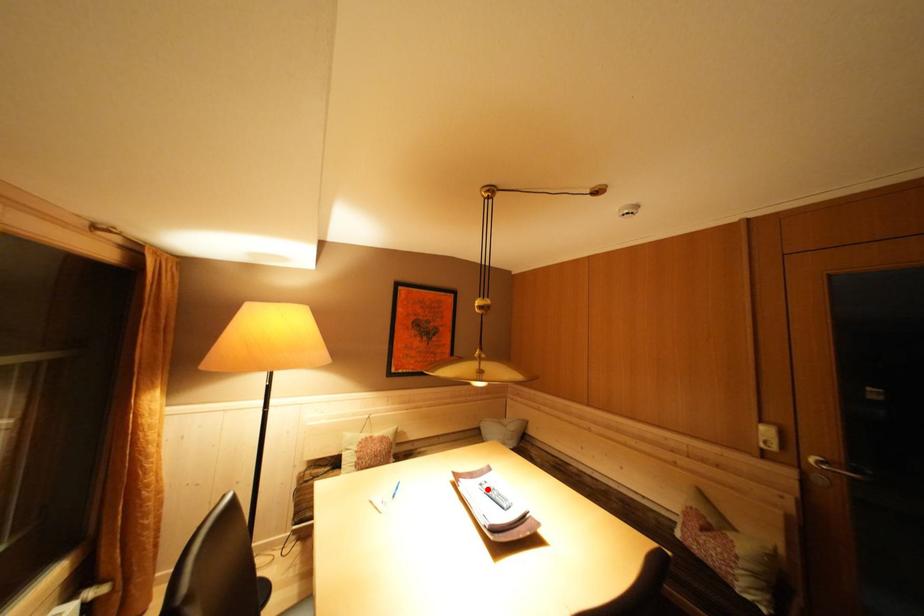
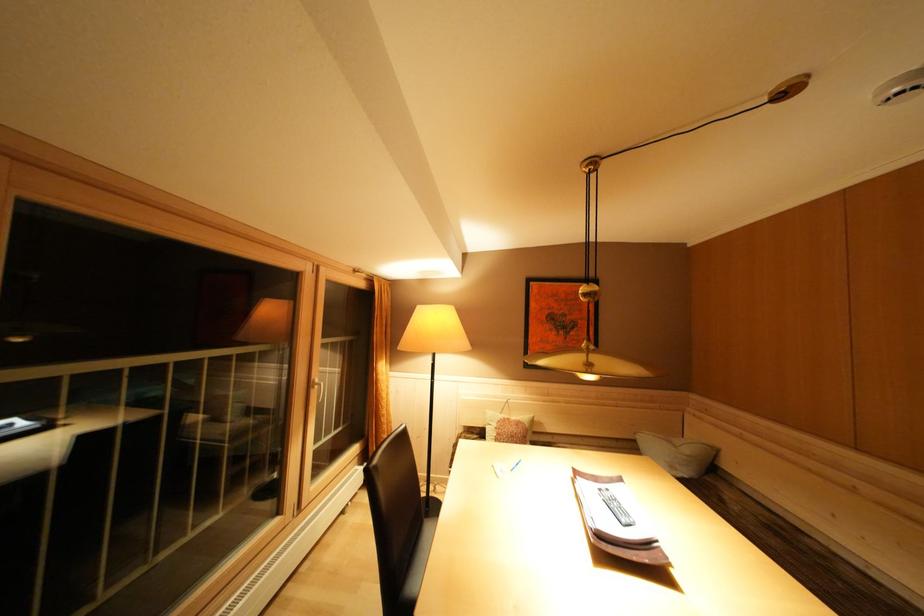
Locate, in the second image, the point that corresponds to the highlighted location in the first image.

(608, 495)